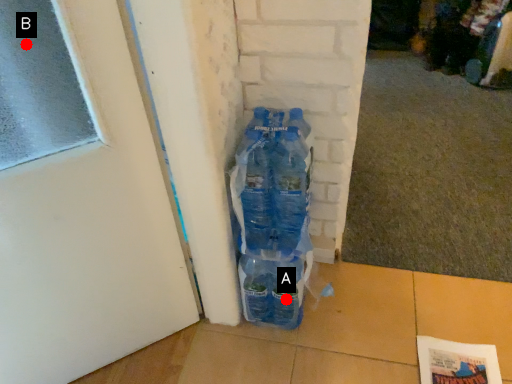
Question: Two points are circled on the image, labeled by A and B beside each circle. Which point appears farthest from the camera in this image?

Choices:
 (A) A is further
 (B) B is further

Answer: (A)